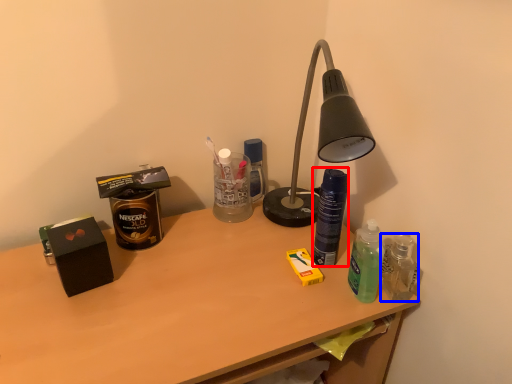
Question: Among these objects, which one is nearest to the camera, bottle (highlighted by a red box) or bottle (highlighted by a blue box)?

Choices:
 (A) bottle
 (B) bottle

Answer: (B)